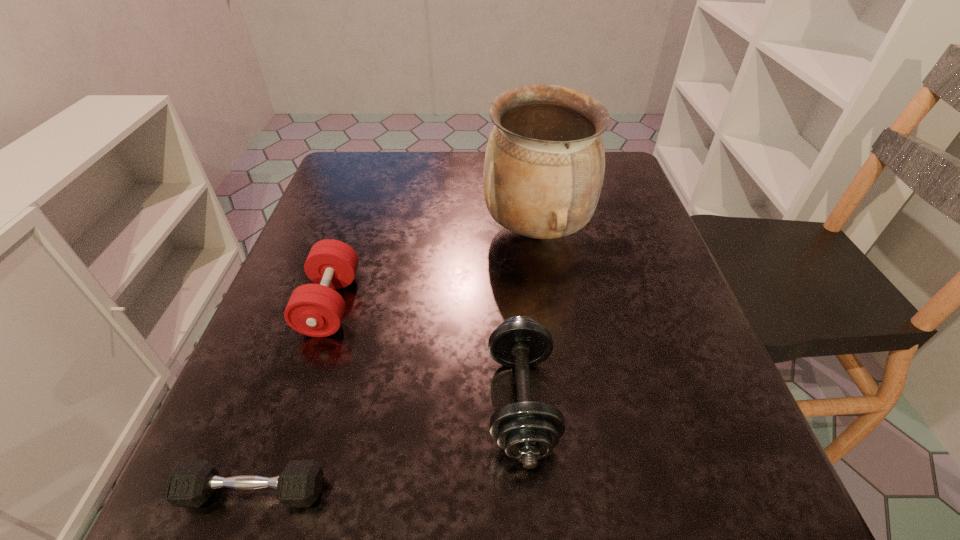
Find the location of a particular element. The width and height of the screenshot is (960, 540). vacant area between the shortest object and the rightmost dumbbell is located at coordinates (387, 446).

Locate an element on the screen. This screenshot has height=540, width=960. object that is the nearest to the rightmost dumbbell is located at coordinates (544, 166).

You are a GUI agent. You are given a task and a screenshot of the screen. Output one action in this format:
    pyautogui.click(x=<x>, y=<y>)
    Task: Click on the object that ranks as the closest to the tallest object
    Image resolution: width=960 pixels, height=540 pixels.
    Given the screenshot: What is the action you would take?
    pyautogui.click(x=527, y=431)

What are the coordinates of `dumbbell identified as the closest to the rightmost dumbbell` in the screenshot? It's located at (191, 484).

The image size is (960, 540). I want to click on the second closest dumbbell to the shortest dumbbell, so click(316, 310).

Identify the location of vacant space that satisfies the following two spatial constraints: 1. on the back side of the shortest object; 2. on the left side of the urn. (346, 231).